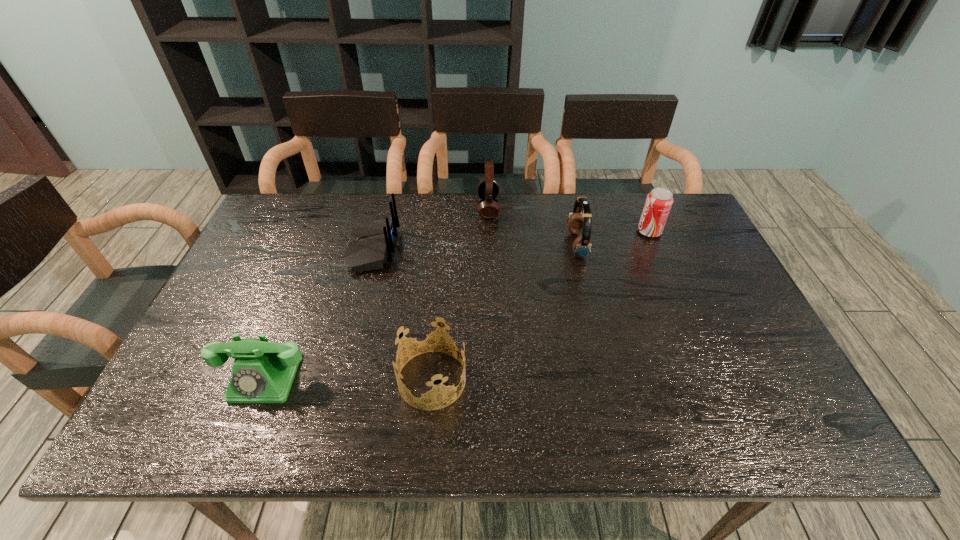
In order to click on the second closest object to the router in this screenshot , I will do `click(263, 372)`.

Locate which object is the second closest to the soda can. Please provide its 2D coordinates. Your answer should be formatted as a tuple, i.e. [(x, y)], where the tuple contains the x and y coordinates of a point satisfying the conditions above.

[(488, 189)]

Identify the location of blank area in the image that satisfies the following two spatial constraints: 1. on the back of the router; 2. on the dial of the telephone. (340, 377).

Locate an element on the screen. free point that satisfies the following two spatial constraints: 1. on the dial of the telephone; 2. on the left side of the third object from left to right is located at coordinates (264, 380).

Locate an element on the screen. The height and width of the screenshot is (540, 960). free space that satisfies the following two spatial constraints: 1. on the dial of the telephone; 2. on the right side of the crown is located at coordinates (264, 380).

Find the location of a particular element. This screenshot has height=540, width=960. vacant region that satisfies the following two spatial constraints: 1. on the dial of the telephone; 2. on the right side of the third object from left to right is located at coordinates (264, 380).

You are a GUI agent. You are given a task and a screenshot of the screen. Output one action in this format:
    pyautogui.click(x=<x>, y=<y>)
    Task: Click on the vacant area in the image that satisfies the following two spatial constraints: 1. on the back side of the third object from left to right; 2. on the back of the router
    This screenshot has height=540, width=960.
    Given the screenshot: What is the action you would take?
    pyautogui.click(x=444, y=248)

This screenshot has width=960, height=540. In order to click on free space in the image that satisfies the following two spatial constraints: 1. on the ear cup of the nearer headset; 2. on the dial of the telephone in this screenshot , I will do `click(609, 377)`.

Where is `vacant space that satisfies the following two spatial constraints: 1. on the back of the router; 2. on the left side of the fourth object from right to left`? Image resolution: width=960 pixels, height=540 pixels. vacant space that satisfies the following two spatial constraints: 1. on the back of the router; 2. on the left side of the fourth object from right to left is located at coordinates (339, 380).